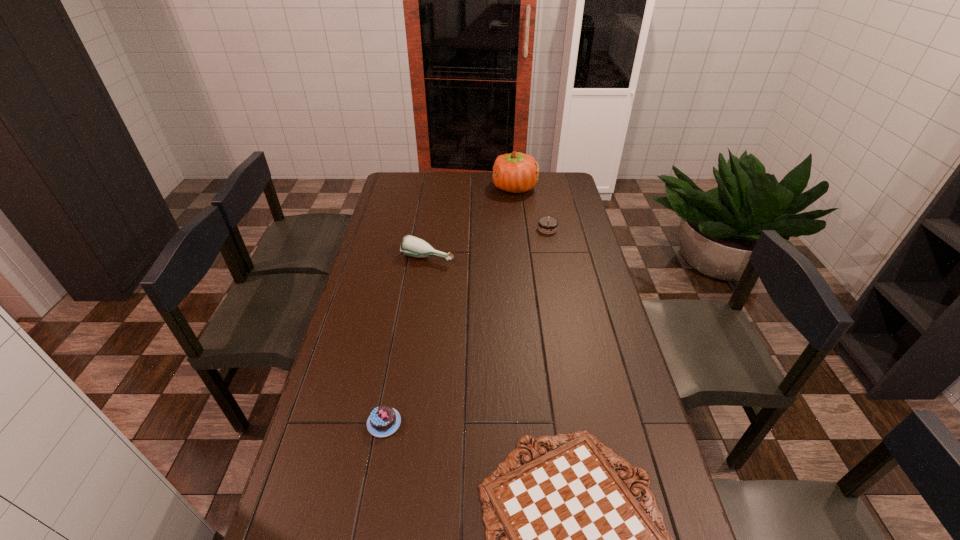
Find the location of a particular element. The height and width of the screenshot is (540, 960). the farthest object is located at coordinates (516, 172).

You are a GUI agent. You are given a task and a screenshot of the screen. Output one action in this format:
    pyautogui.click(x=<x>, y=<y>)
    Task: Click on the tallest object
    The height and width of the screenshot is (540, 960).
    Given the screenshot: What is the action you would take?
    pyautogui.click(x=516, y=172)

The height and width of the screenshot is (540, 960). In order to click on the third nearest object in this screenshot , I will do `click(412, 246)`.

Locate an element on the screen. This screenshot has width=960, height=540. the fourth shortest object is located at coordinates (412, 246).

Image resolution: width=960 pixels, height=540 pixels. Find the location of `the farther chocolate cake`. the farther chocolate cake is located at coordinates (548, 225).

Find the location of `the right chocolate cake`. the right chocolate cake is located at coordinates (548, 225).

Locate an element on the screen. The image size is (960, 540). the nearer chocolate cake is located at coordinates (384, 420).

I want to click on the fourth tallest object, so click(384, 420).

You are a GUI agent. You are given a task and a screenshot of the screen. Output one action in this format:
    pyautogui.click(x=<x>, y=<y>)
    Task: Click on the free space located 0.080m on the side of the pumpkin with the cute face
    
    Given the screenshot: What is the action you would take?
    pyautogui.click(x=476, y=188)

This screenshot has width=960, height=540. Find the location of `free space located 0.180m on the side of the pumpkin with the cute face`. free space located 0.180m on the side of the pumpkin with the cute face is located at coordinates (456, 188).